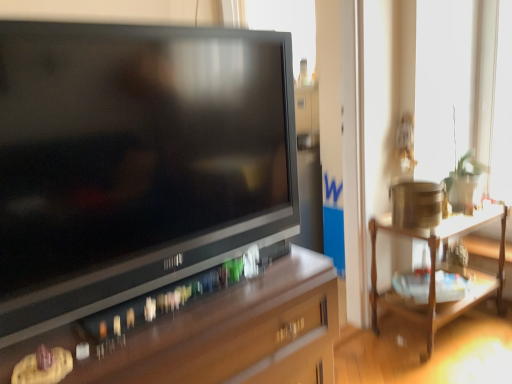
Where is `matte black television at center`? This screenshot has height=384, width=512. matte black television at center is located at coordinates (135, 160).

Is matte black television at center wider or thinner than brown wood desk at lower left?

Clearly, matte black television at center has less width compared to brown wood desk at lower left.

Is matte black television at center oriented away from brown wood desk at lower left?

No, matte black television at center is not facing the opposite direction of brown wood desk at lower left.

Does matte black television at center touch brown wood desk at lower left?

No, matte black television at center is not making contact with brown wood desk at lower left.

Find the location of a particular element. This screenshot has width=512, height=384. television in front of the brown wood desk at lower left is located at coordinates (135, 160).

Between wooden table at right and matte black television at center, which one is positioned in front?

matte black television at center is closer to the camera.

From the image's perspective, is wooden table at right positioned above or below matte black television at center?

Clearly, from the image's perspective, wooden table at right is below matte black television at center.

From the picture: Which object is positioned more to the left, wooden table at right or matte black television at center?

Positioned to the left is matte black television at center.

Is point (385, 220) in front of point (189, 126)?

No, it is behind (189, 126).

From the image's perspective, is brown wood desk at lower left on wooden table at right?

Incorrect, from the image's perspective, brown wood desk at lower left is lower than wooden table at right.

Can you confirm if brown wood desk at lower left is taller than wooden table at right?

Indeed, brown wood desk at lower left has a greater height compared to wooden table at right.

From a real-world perspective, is brown wood desk at lower left located higher than wooden table at right?

Yes, from a real-world perspective, brown wood desk at lower left is on top of wooden table at right.

Is brown wood desk at lower left in contact with wooden table at right?

No, brown wood desk at lower left is not making contact with wooden table at right.

Is matte black television at center smaller than wooden table at right?

Yes, matte black television at center is smaller than wooden table at right.

Could you tell me if matte black television at center is turned towards wooden table at right?

No, matte black television at center does not turn towards wooden table at right.

Does matte black television at center appear on the left side of wooden table at right?

Indeed, matte black television at center is positioned on the left side of wooden table at right.

From the image's perspective, between matte black television at center and wooden table at right, which one is located above?

matte black television at center is shown above in the image.

Can you confirm if brown wood desk at lower left is positioned to the left of matte black television at center?

Yes.

From a real-world perspective, is brown wood desk at lower left over matte black television at center?

Actually, brown wood desk at lower left is physically below matte black television at center in the real world.

Consider the image. Can you confirm if brown wood desk at lower left is taller than matte black television at center?

Incorrect, the height of brown wood desk at lower left is not larger of that of matte black television at center.

Can matte black television at center be found inside brown wood desk at lower left?

No.

Is wooden table at right inside the boundaries of brown wood desk at lower left, or outside?

wooden table at right is located beyond the bounds of brown wood desk at lower left.

Image resolution: width=512 pixels, height=384 pixels. Identify the location of table that is above the brown wood desk at lower left (from the image's perspective). (435, 270).

Is wooden table at right with brown wood desk at lower left?

wooden table at right is not next to brown wood desk at lower left, and they're not touching.

Who is shorter, wooden table at right or brown wood desk at lower left?

With less height is wooden table at right.

You are a GUI agent. You are given a task and a screenshot of the screen. Output one action in this format:
    pyautogui.click(x=<x>, y=<y>)
    Task: Click on the desk below the matte black television at center (from a real-world perspective)
    
    Given the screenshot: What is the action you would take?
    [220, 335]

Locate an element on the screen. table below the matte black television at center (from the image's perspective) is located at coordinates (435, 270).

Considering their positions, is wooden table at right positioned further to matte black television at center than brown wood desk at lower left?

wooden table at right lies further to matte black television at center than the other object.

When comparing their distances from wooden table at right, does matte black television at center or brown wood desk at lower left seem closer?

Among the two, brown wood desk at lower left is located nearer to wooden table at right.

Which object lies nearer to the anchor point brown wood desk at lower left, wooden table at right or matte black television at center?

matte black television at center is positioned closer to the anchor brown wood desk at lower left.

From the image, which object appears to be nearer to wooden table at right, brown wood desk at lower left or matte black television at center?

The object closer to wooden table at right is brown wood desk at lower left.

Which object lies nearer to the anchor point brown wood desk at lower left, matte black television at center or wooden table at right?

matte black television at center.

When comparing their distances from matte black television at center, does brown wood desk at lower left or wooden table at right seem closer?

brown wood desk at lower left is closer to matte black television at center.

Locate an element on the screen. television situated between brown wood desk at lower left and wooden table at right from left to right is located at coordinates (135, 160).